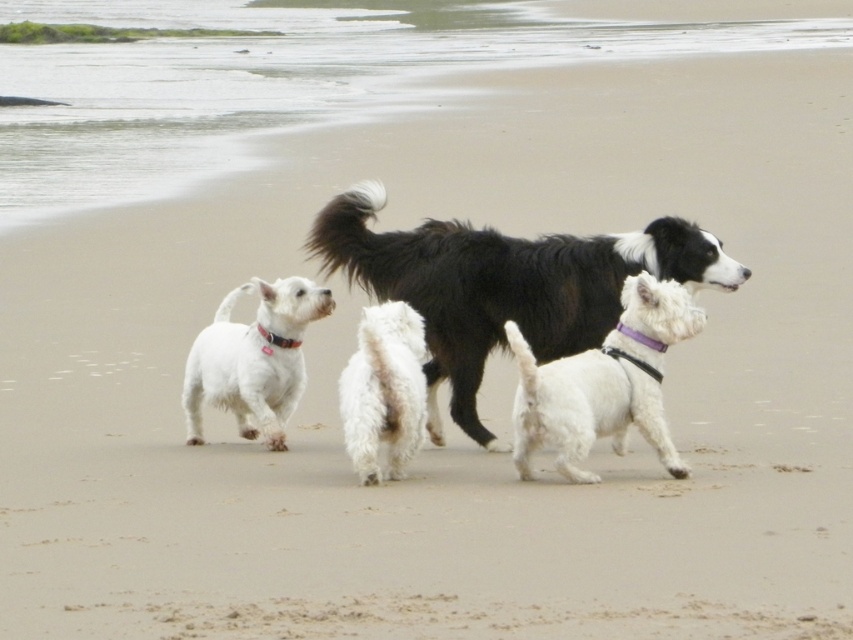
What do you see at coordinates (503, 285) in the screenshot? I see `black fluffy dog at center` at bounding box center [503, 285].

How distant is black fluffy dog at center from white soft fur dog at left?

black fluffy dog at center is 64.04 centimeters from white soft fur dog at left.

Describe the element at coordinates (503, 285) in the screenshot. I see `black fluffy dog at center` at that location.

Locate an element on the screen. Image resolution: width=853 pixels, height=640 pixels. black fluffy dog at center is located at coordinates (503, 285).

Is white matte dog at center thinner than white soft fur dog at left?

No.

Is point (679, 464) more distant than point (296, 376)?

No, (679, 464) is closer to viewer.

At what (x,y) coordinates should I click in order to perform the action: click on white matte dog at center. Please return your answer as a coordinate pair (x, y). This screenshot has height=640, width=853. Looking at the image, I should click on (602, 384).

Between black fluffy dog at center and white matte dog at center, which one is positioned lower?

white matte dog at center is below.

Is black fluffy dog at center further to the viewer compared to white matte dog at center?

Yes, it is behind white matte dog at center.

Find the location of a particular element. black fluffy dog at center is located at coordinates (503, 285).

In order to click on black fluffy dog at center in this screenshot , I will do `click(503, 285)`.